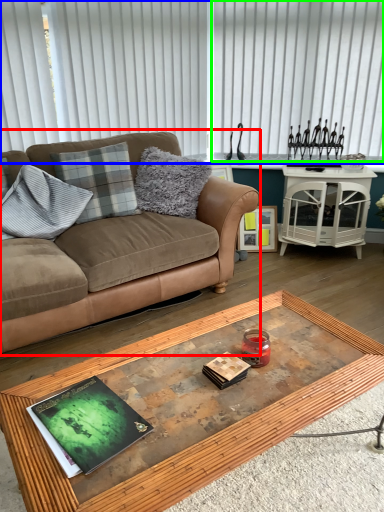
Question: Which object is the closest to the studio couch (highlighted by a red box)? Choose among these: blind (highlighted by a blue box) or blind (highlighted by a green box).

Choices:
 (A) blind
 (B) blind

Answer: (A)